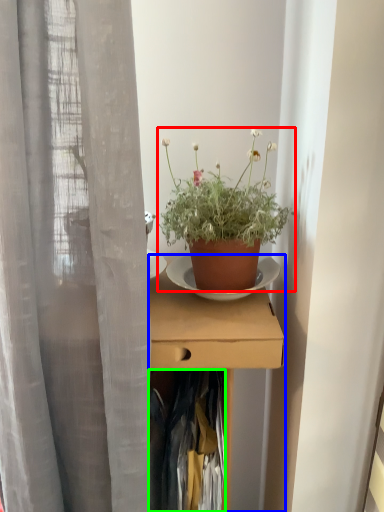
Question: Based on their relative distances, which object is farther from houseplant (highlighted by a red box)? Choose from desk (highlighted by a blue box) and clothing (highlighted by a green box).

Choices:
 (A) desk
 (B) clothing

Answer: (B)